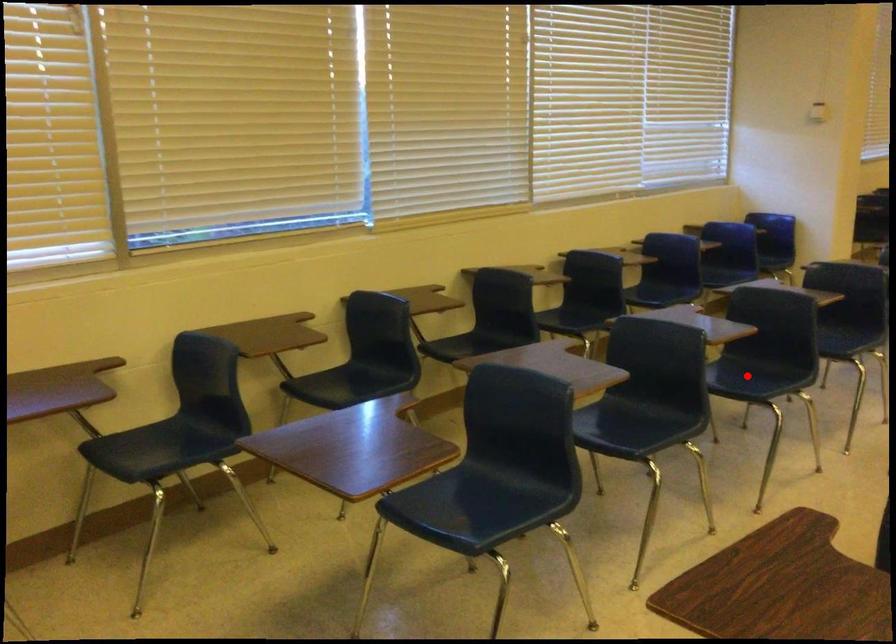
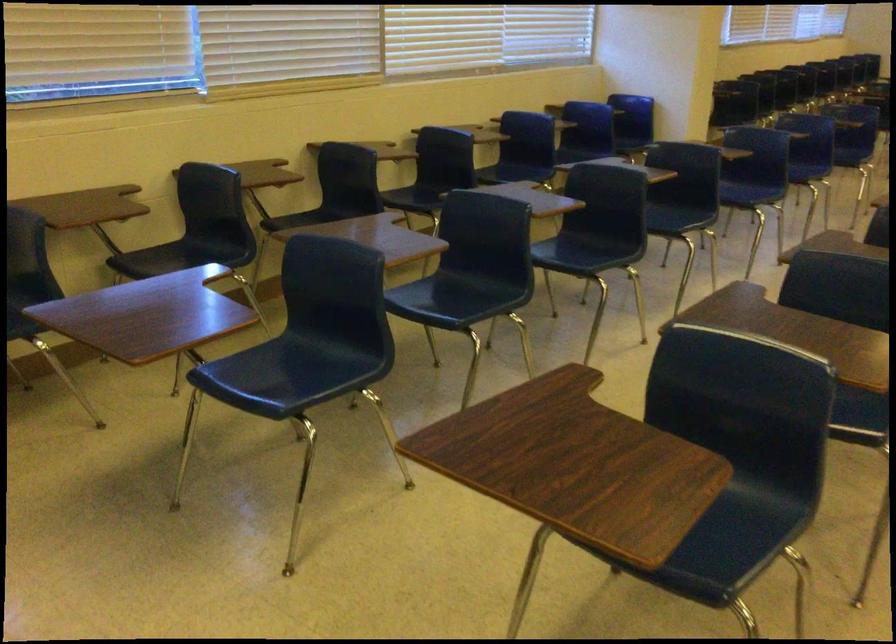
The point at the highlighted location is marked in the first image. Where is the corresponding point in the second image?

(586, 252)